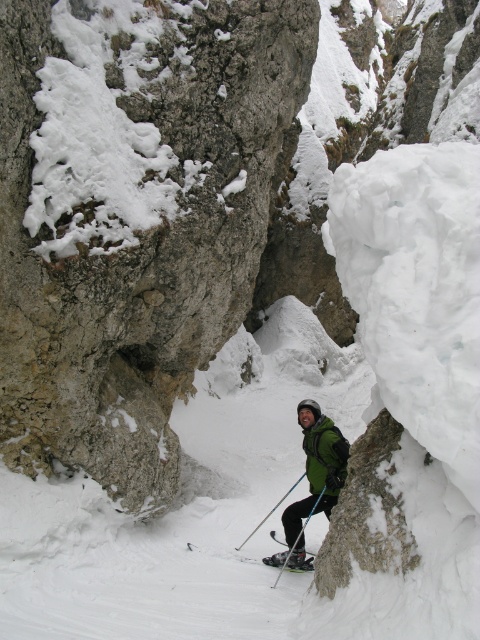
Question: From the image, what is the correct spatial relationship of matte black ski at center in relation to blue metallic ski pole at center?

Choices:
 (A) above
 (B) below

Answer: (A)

Question: Is green matte jacket at center above matte black ski pole at center?

Choices:
 (A) yes
 (B) no

Answer: (A)

Question: Which of the following is the farthest from the observer?

Choices:
 (A) blue metallic ski pole at center
 (B) matte black ski at center
 (C) green matte jacket at center

Answer: (A)

Question: Which is nearer to the matte black ski pole at center?

Choices:
 (A) matte black ski at center
 (B) green matte jacket at center
 (C) blue metallic ski pole at center

Answer: (A)

Question: From the image, what is the correct spatial relationship of green matte jacket at center in relation to matte black ski pole at center?

Choices:
 (A) right
 (B) left

Answer: (A)

Question: Which point is closer to the camera taking this photo?

Choices:
 (A) (282, 499)
 (B) (273, 564)
 (C) (336, 458)

Answer: (C)